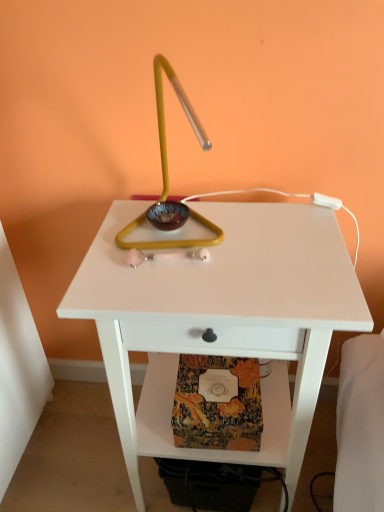
What are the coordinates of `free point above white wood nightstand at center (from a real-world perspective)` in the screenshot? It's located at (212, 244).